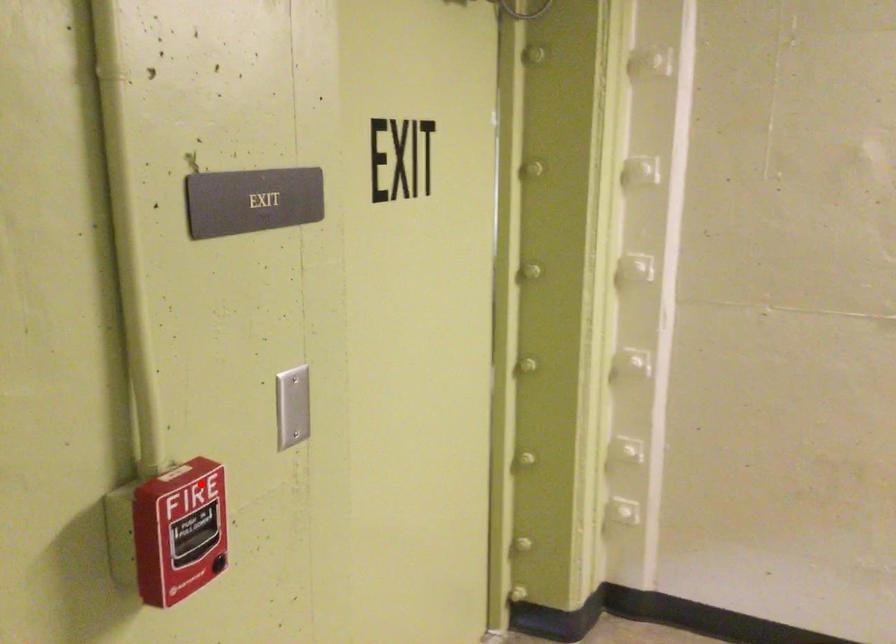
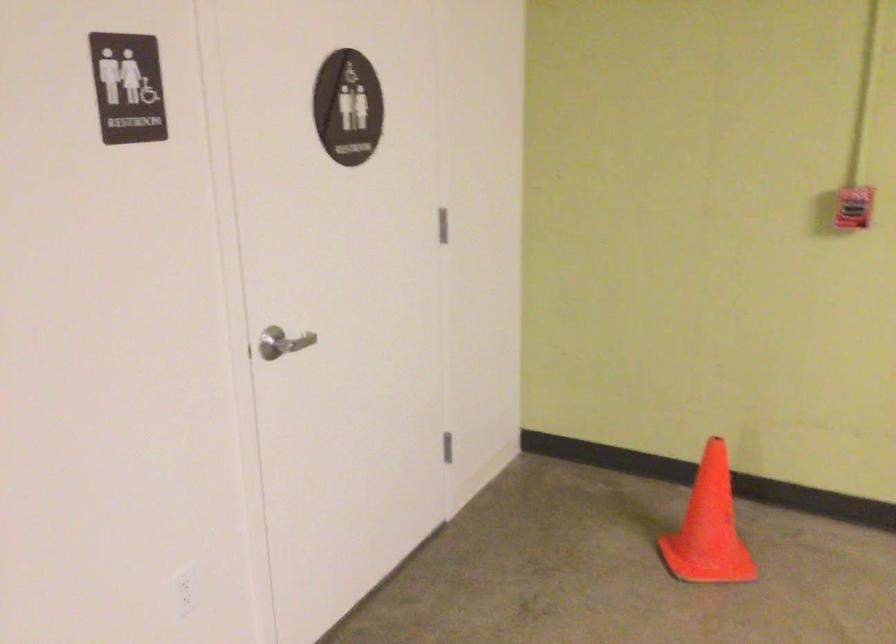
Locate, in the second image, the point that corresponds to the highlighted location in the first image.

(854, 207)